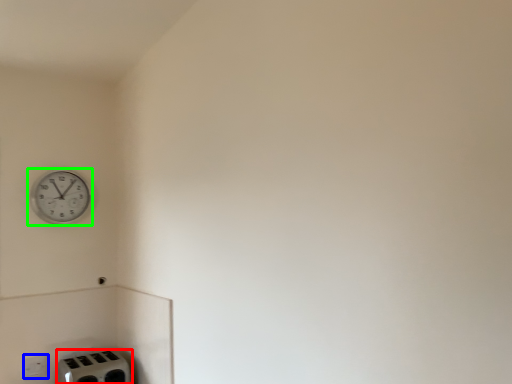
Question: Which is nearer to the appliance (highlighted by a red box)? electric outlet (highlighted by a blue box) or wall clock (highlighted by a green box).

Choices:
 (A) electric outlet
 (B) wall clock

Answer: (A)